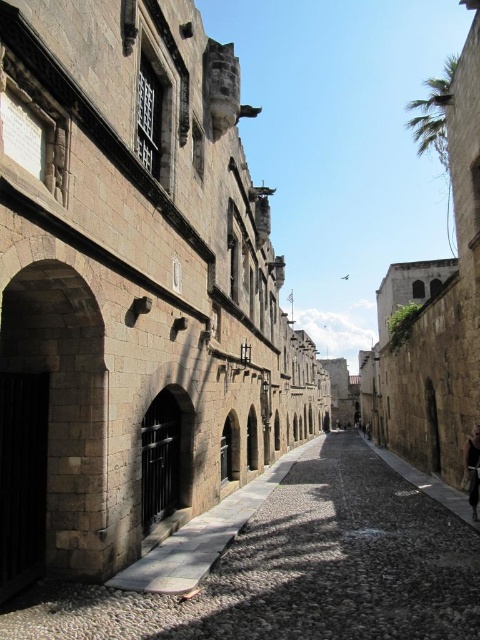
You are a delivery person carrying a large box that measures 5 feet in length. You need to navigate through the narrow cobblestone street shown in the image. Considering the distance between the stone paved alley at center and the dark brown leather jacket at lower right, will your box fit through the space between them?

The distance between the stone paved alley at center and the dark brown leather jacket at lower right is 48.52 feet. Since your box is only 5 feet long, it will easily fit through the space between them.